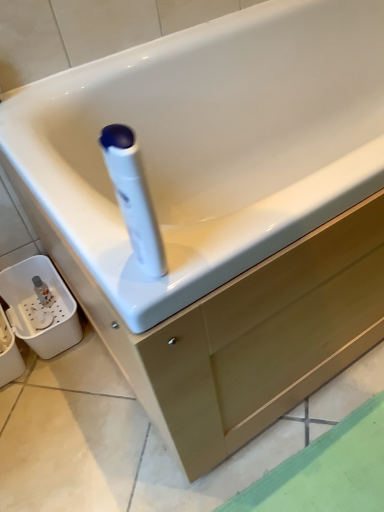
Describe the element at coordinates (133, 197) in the screenshot. I see `white glossy cleaning product at center` at that location.

The image size is (384, 512). Identify the location of white glossy cleaning product at center. (133, 197).

In the scene shown: What is the approximate width of matte wood drawer at center?

3.45 feet.

The width and height of the screenshot is (384, 512). Describe the element at coordinates (267, 340) in the screenshot. I see `matte wood drawer at center` at that location.

In order to face matte wood drawer at center, should I rotate leftwards or rightwards?

You should rotate right by 0.527 degrees.

Locate an element on the screen. matte wood drawer at center is located at coordinates (267, 340).

At what (x,y) coordinates should I click in order to perform the action: click on white glossy cleaning product at center. Please return your answer as a coordinate pair (x, y). Image resolution: width=384 pixels, height=512 pixels. Looking at the image, I should click on (133, 197).

Is matte wood drawer at center at the left side of white glossy cleaning product at center?

In fact, matte wood drawer at center is to the right of white glossy cleaning product at center.

Does matte wood drawer at center come in front of white glossy cleaning product at center?

No, matte wood drawer at center is further to the viewer.

Which point is more distant from viewer, (234, 365) or (136, 223)?

Positioned behind is point (234, 365).

From the image's perspective, would you say matte wood drawer at center is shown under white glossy cleaning product at center?

Indeed, from the image's perspective, matte wood drawer at center is shown beneath white glossy cleaning product at center.

From a real-world perspective, does matte wood drawer at center sit lower than white glossy cleaning product at center?

Yes.

Between matte wood drawer at center and white glossy cleaning product at center, which one has smaller width?

With smaller width is white glossy cleaning product at center.

Considering the relative sizes of matte wood drawer at center and white glossy cleaning product at center in the image provided, is matte wood drawer at center shorter than white glossy cleaning product at center?

Correct, matte wood drawer at center is not as tall as white glossy cleaning product at center.

Considering the relative sizes of matte wood drawer at center and white glossy cleaning product at center in the image provided, is matte wood drawer at center smaller than white glossy cleaning product at center?

No.

From the picture: Is matte wood drawer at center situated inside white glossy cleaning product at center or outside?

matte wood drawer at center is spatially situated outside white glossy cleaning product at center.

Is matte wood drawer at center directly adjacent to white glossy cleaning product at center?

No, matte wood drawer at center is not in contact with white glossy cleaning product at center.

Does matte wood drawer at center turn towards white glossy cleaning product at center?

No, matte wood drawer at center is not oriented towards white glossy cleaning product at center.

Locate an element on the screen. This screenshot has height=512, width=384. drawer below the white glossy cleaning product at center (from the image's perspective) is located at coordinates (267, 340).

Which object is positioned more to the right, white glossy cleaning product at center or matte wood drawer at center?

From the viewer's perspective, matte wood drawer at center appears more on the right side.

Which object is closer to the camera, white glossy cleaning product at center or matte wood drawer at center?

white glossy cleaning product at center is closer to the camera.

Is point (143, 186) closer or farther from the camera than point (152, 416)?

Clearly, point (143, 186) is closer to the camera than point (152, 416).

From the image's perspective, is white glossy cleaning product at center located above or below matte wood drawer at center?

From the image's perspective, white glossy cleaning product at center appears above matte wood drawer at center.

From a real-world perspective, is white glossy cleaning product at center over matte wood drawer at center?

Correct, in the physical world, white glossy cleaning product at center is higher than matte wood drawer at center.

Is white glossy cleaning product at center wider than matte wood drawer at center?

No.

Is white glossy cleaning product at center taller or shorter than matte wood drawer at center?

In the image, white glossy cleaning product at center appears to be taller than matte wood drawer at center.

Looking at the image, does white glossy cleaning product at center seem bigger or smaller compared to matte wood drawer at center?

Considering their sizes, white glossy cleaning product at center takes up less space than matte wood drawer at center.

Would you say matte wood drawer at center is part of white glossy cleaning product at center's contents?

No, matte wood drawer at center is located outside of white glossy cleaning product at center.

Is there a large distance between white glossy cleaning product at center and matte wood drawer at center?

Actually, white glossy cleaning product at center and matte wood drawer at center are a little close together.

Is white glossy cleaning product at center oriented away from matte wood drawer at center?

white glossy cleaning product at center is not turned away from matte wood drawer at center.

What's the angular difference between white glossy cleaning product at center and matte wood drawer at center's facing directions?

The angle between the facing direction of white glossy cleaning product at center and the facing direction of matte wood drawer at center is 88 degrees.

In order to click on drawer directly beneath the white glossy cleaning product at center (from a real-world perspective) in this screenshot , I will do `click(267, 340)`.

Locate an element on the screen. drawer behind the white glossy cleaning product at center is located at coordinates (267, 340).

Locate an element on the screen. This screenshot has width=384, height=512. drawer below the white glossy cleaning product at center (from the image's perspective) is located at coordinates (267, 340).